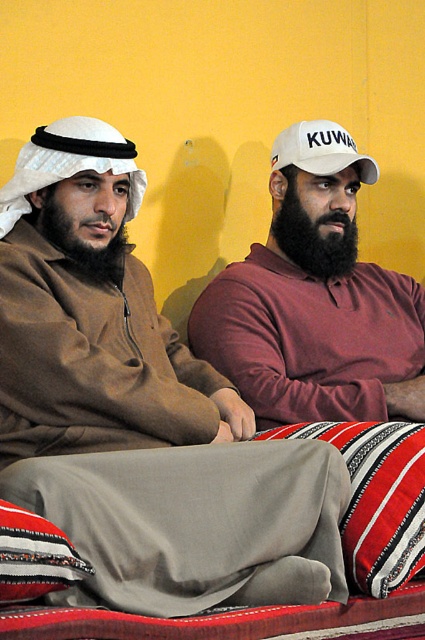
Question: Which object is the farthest from the striped fabric pillow at lower left?

Choices:
 (A) maroon cotton shirt at center
 (B) white fabric baseball cap at upper right

Answer: (B)

Question: Is striped fabric pillow at lower left above white fabric baseball cap at upper right?

Choices:
 (A) yes
 (B) no

Answer: (B)

Question: Which point is farther to the camera?

Choices:
 (A) striped fabric pillow at lower left
 (B) striped fabric pillow at lower right

Answer: (B)

Question: Can you confirm if striped fabric pillow at lower left is positioned to the left of white fabric baseball cap at upper right?

Choices:
 (A) yes
 (B) no

Answer: (A)

Question: Is white matte cap at upper right positioned at the back of striped fabric pillow at lower left?

Choices:
 (A) yes
 (B) no

Answer: (A)

Question: Which point is farther to the camera?

Choices:
 (A) (337, 164)
 (B) (393, 568)
 (C) (36, 554)
 (D) (306, 452)

Answer: (A)